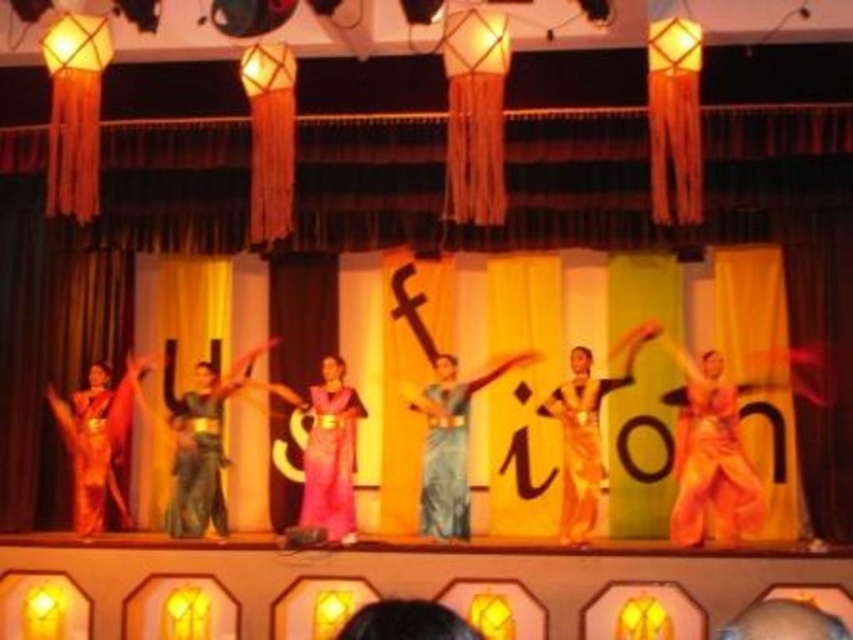
Can you confirm if matte green saree at center is taller than orange silk saree at center?

Yes.

Describe the element at coordinates (200, 442) in the screenshot. The image size is (853, 640). I see `matte green saree at center` at that location.

This screenshot has height=640, width=853. Find the location of `matte green saree at center`. matte green saree at center is located at coordinates (200, 442).

Is matte gold saree at left to the right of orange silk saree at center from the viewer's perspective?

No, matte gold saree at left is not to the right of orange silk saree at center.

Between matte gold saree at left and orange silk saree at center, which one appears on the right side from the viewer's perspective?

orange silk saree at center is more to the right.

This screenshot has height=640, width=853. Identify the location of matte gold saree at left. (97, 440).

Does orange silk saree at center come in front of blue silk saree at center?

That is True.

Does orange silk saree at center have a smaller size compared to blue silk saree at center?

Incorrect, orange silk saree at center is not smaller in size than blue silk saree at center.

Does point (550, 396) lie in front of point (460, 451)?

No, (550, 396) is behind (460, 451).

Image resolution: width=853 pixels, height=640 pixels. In order to click on orange silk saree at center in this screenshot , I will do `click(585, 432)`.